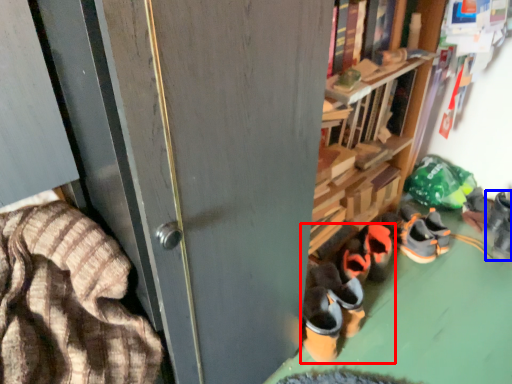
Question: Which object appears closest to the camera in this image, footwear (highlighted by a red box) or footwear (highlighted by a blue box)?

Choices:
 (A) footwear
 (B) footwear

Answer: (A)